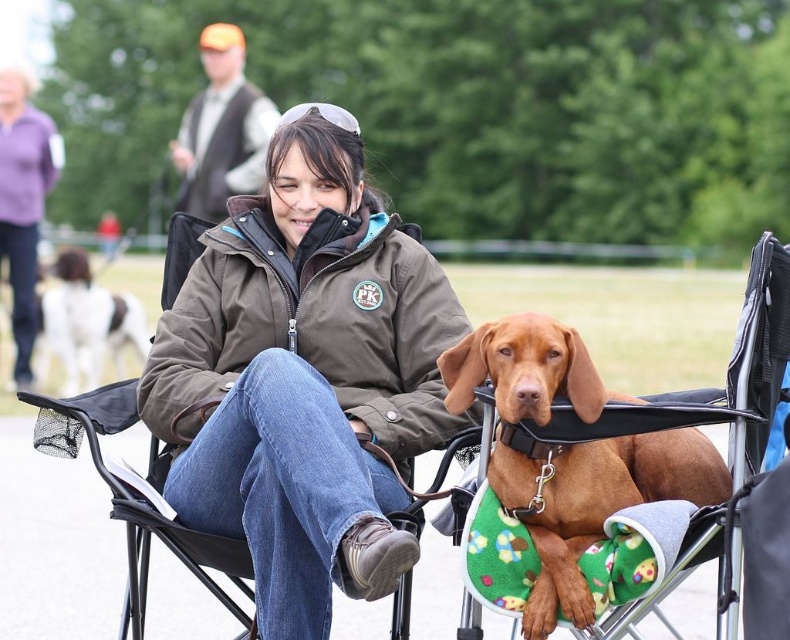
Between brown soft jacket at center and white fur dog at left, which one is positioned higher?

white fur dog at left is higher up.

Between point (375, 346) and point (115, 310), which one is positioned behind?

Positioned behind is point (115, 310).

The width and height of the screenshot is (790, 640). I want to click on brown soft jacket at center, so click(303, 378).

Is brown soft jacket at center further to the viewer compared to orange fabric vest at upper left?

No, it is in front of orange fabric vest at upper left.

Which is below, brown soft jacket at center or orange fabric vest at upper left?

brown soft jacket at center

Who is more forward, (401, 561) or (198, 204)?

Point (401, 561)

Find the location of a particular element. The width and height of the screenshot is (790, 640). brown soft jacket at center is located at coordinates (303, 378).

Is brown soft fabric dog at center below purple fleece jacket at upper left?

Yes, brown soft fabric dog at center is below purple fleece jacket at upper left.

Which is behind, point (577, 342) or point (47, 173)?

The point (47, 173) is behind.

Identify the location of brown soft fabric dog at center. (567, 456).